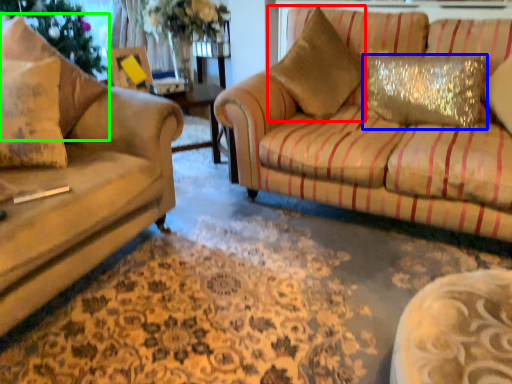
Question: Which is nearer to the throw pillow (highlighted by a red box)? pillow (highlighted by a blue box) or pillow (highlighted by a green box).

Choices:
 (A) pillow
 (B) pillow

Answer: (A)